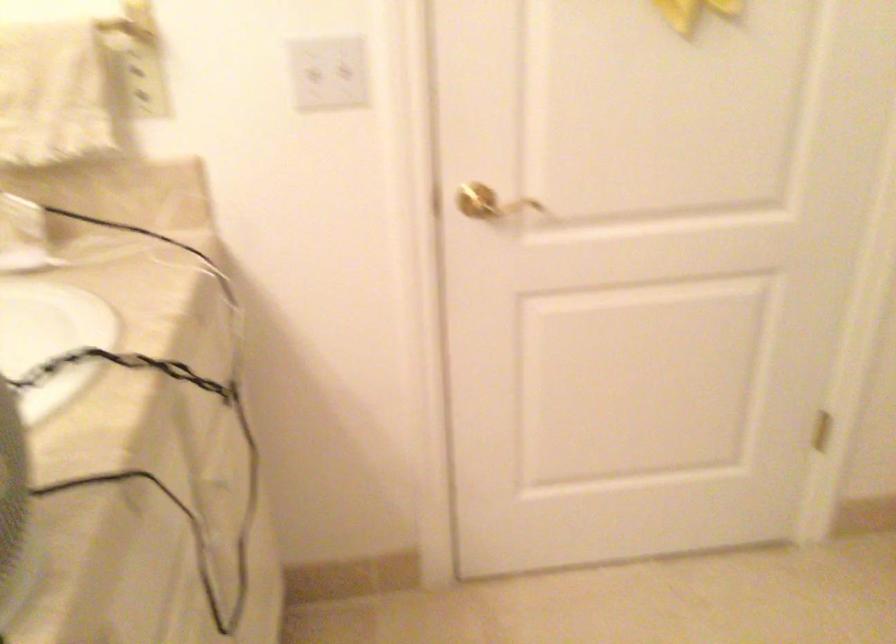
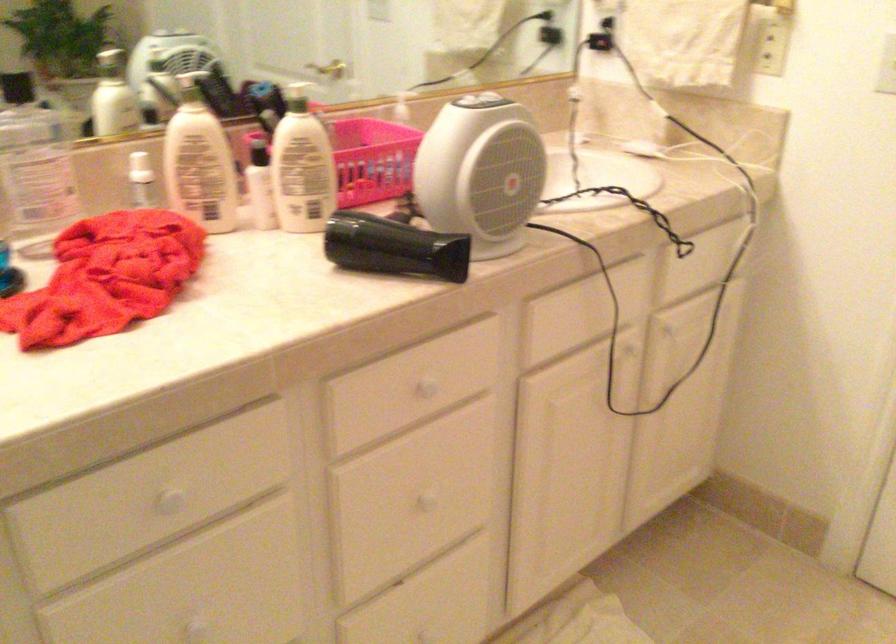
In the second image, find the point that corresponds to (209,533) in the first image.

(625, 348)